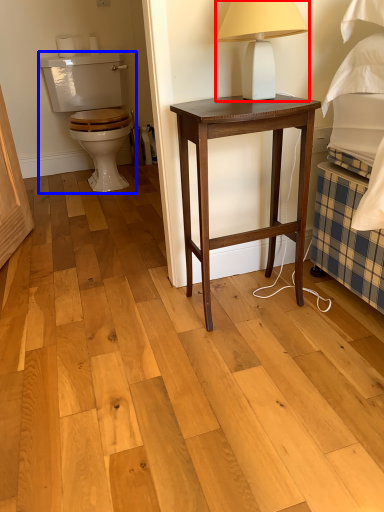
Question: Among these objects, which one is farthest to the camera, table lamp (highlighted by a red box) or armchair (highlighted by a blue box)?

Choices:
 (A) table lamp
 (B) armchair

Answer: (B)